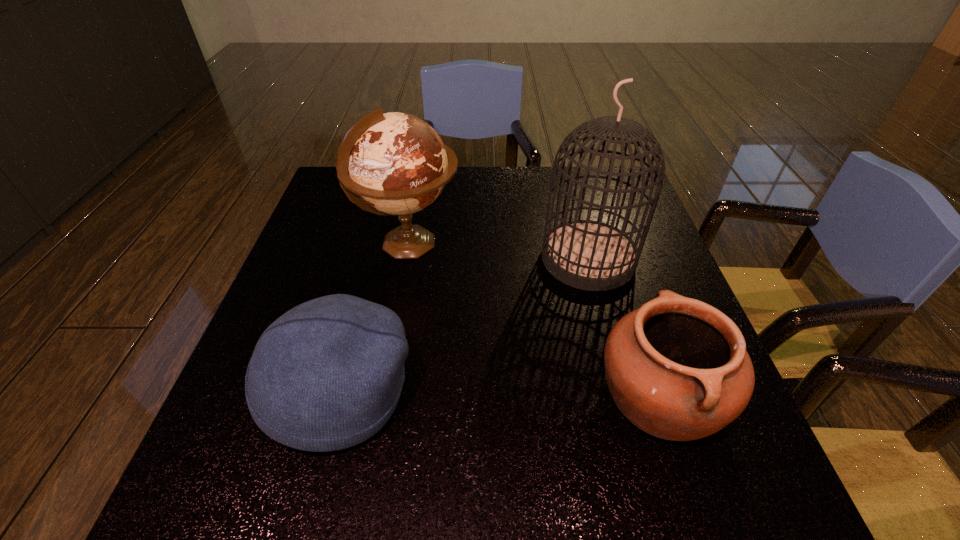
Find the location of a particular element. This screenshot has height=540, width=960. the tallest object is located at coordinates (589, 255).

The height and width of the screenshot is (540, 960). I want to click on the second tallest object, so click(x=395, y=163).

Identify the location of skullcap. click(327, 375).

The image size is (960, 540). I want to click on pottery, so click(677, 368).

Find the location of a particular element. The width and height of the screenshot is (960, 540). free space located 0.260m on the left of the tallest object is located at coordinates (438, 259).

This screenshot has height=540, width=960. I want to click on free space located on the front of the second tallest object showing Asia, so click(591, 244).

You are a GUI agent. You are given a task and a screenshot of the screen. Output one action in this format:
    pyautogui.click(x=<x>, y=<y>)
    Task: Click on the vacant space located 0.250m on the right of the skullcap
    The height and width of the screenshot is (540, 960).
    Given the screenshot: What is the action you would take?
    pos(548,392)

Identify the location of vacant space positioned 0.190m on the back of the pottery. (622, 280).

Where is `skullcap that is at the near edge`? Image resolution: width=960 pixels, height=540 pixels. skullcap that is at the near edge is located at coordinates (327, 375).

Locate an element on the screen. pottery that is at the near edge is located at coordinates (677, 368).